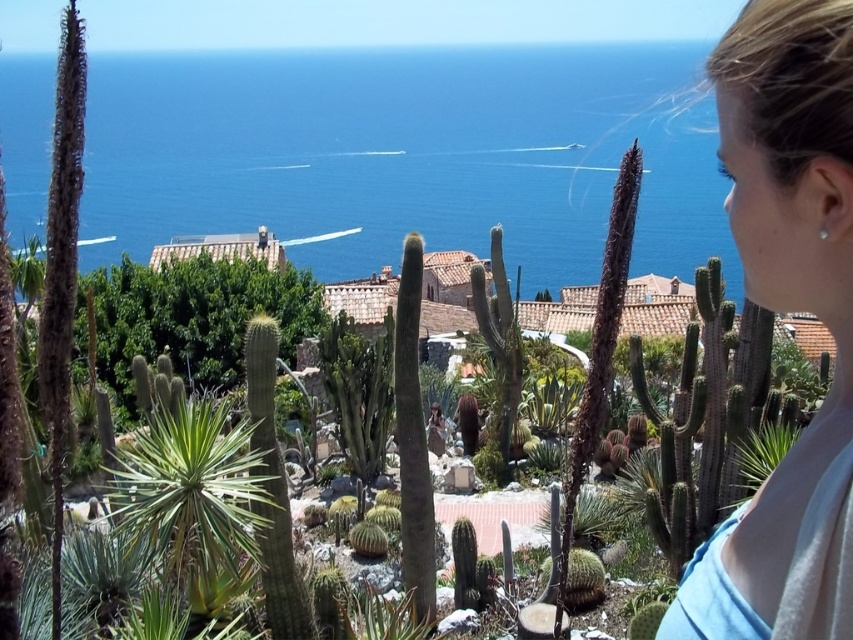
Question: Does blue water at center have a larger size compared to blonde hair at upper right?

Choices:
 (A) yes
 (B) no

Answer: (A)

Question: Can you confirm if blue water at center is positioned to the right of blonde hair at upper right?

Choices:
 (A) yes
 (B) no

Answer: (B)

Question: Does blue water at center have a greater width compared to blonde hair at upper right?

Choices:
 (A) yes
 (B) no

Answer: (A)

Question: Which point is farther from the camera taking this photo?

Choices:
 (A) (485, 230)
 (B) (758, 490)

Answer: (A)

Question: Which object appears farthest from the camera in this image?

Choices:
 (A) blue water at center
 (B) blonde hair at upper right

Answer: (A)